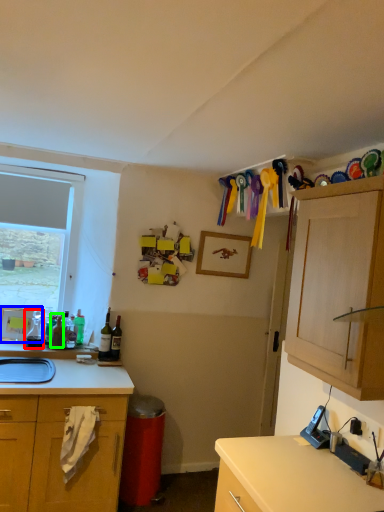
Question: Considering the real-world distances, which object is closest to bottle (highlighted by a red box)? picture frame (highlighted by a blue box) or bottle (highlighted by a green box).

Choices:
 (A) picture frame
 (B) bottle

Answer: (A)